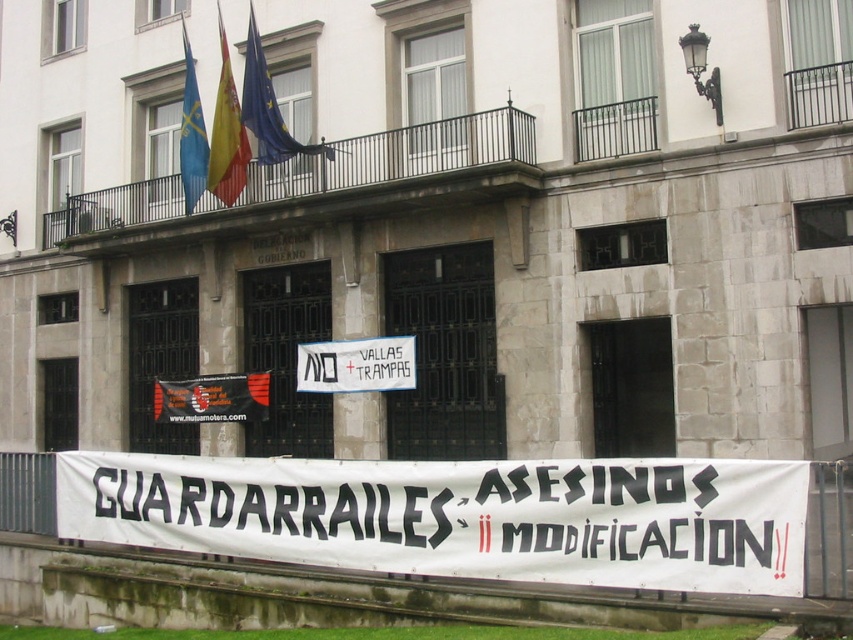
You are standing in front of the building and see the point marked at coordinates (212, 397). Where is this point located in relation to the black fabric banner at lower center?

The point marked at coordinates (212, 397) is located on the black fabric banner at lower center.

You are standing at the point marked at (248, 13). You want to walk to the building entrance which is 24.22 meters away. If your walking speed is 1.5 meters per second, how many seconds will it take you to reach the entrance?

The distance to the entrance is 24.22 meters, and your walking speed is 1.5 meters per second. To calculate the time, divide the distance by speed. 24.22 divided by 1.5 equals approximately 16.15 seconds. So it will take about 16.15 seconds to reach the entrance.

Looking at this image, you are a photographer standing in front of the building. You want to take a photo that includes both the black fabric banner at lower center and the blue fabric flag at upper center. However, you notice that one of the objects is blocking the other. Which object is blocking the other one?

The black fabric banner at lower center is blocking the blue fabric flag at upper center because the blue fabric flag at upper center is behind the black fabric banner at lower center.